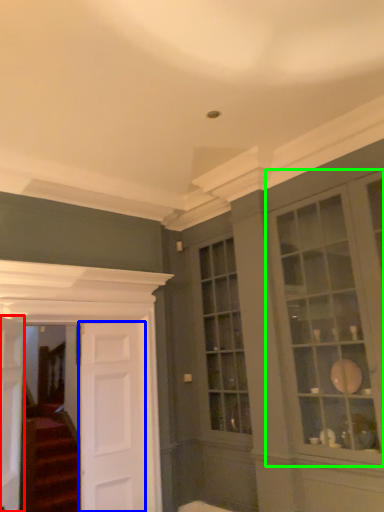
Question: Considering the real-world distances, which object is closest to door (highlighted by a red box)? door (highlighted by a blue box) or window (highlighted by a green box).

Choices:
 (A) door
 (B) window

Answer: (A)